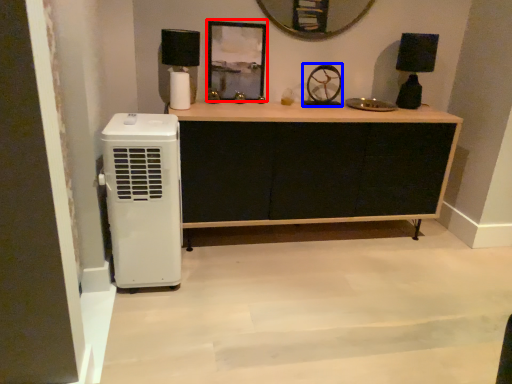
Question: Which object is closer to the camera taking this photo, picture frame (highlighted by a red box) or wheel (highlighted by a blue box)?

Choices:
 (A) picture frame
 (B) wheel

Answer: (A)